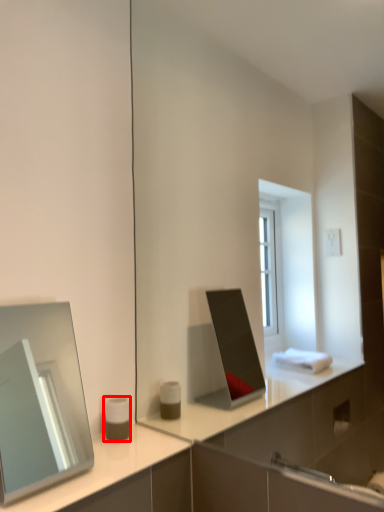
Question: From the image's perspective, where is toiletry (annotated by the red box) located in relation to mirror in the image?

Choices:
 (A) above
 (B) below

Answer: (B)